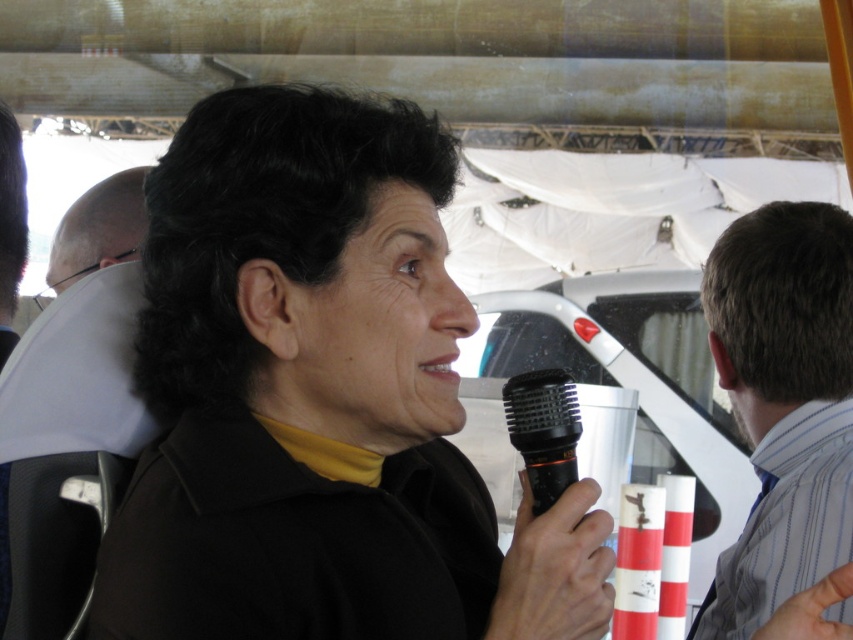
You are standing at the point with coordinates point (10,212) and want to walk towards the woman holding the microphone. Will you pass by point (534,422) on your way?

Yes, because point (534,422) is in front of point (10,212), so walking towards the woman holding the microphone would require passing through that point.

You are a photographer at the scene and want to focus on the gray striped shirt at right and the matte black microphone at left. Which object should you adjust your camera to prioritize in focus if you want the one that is closer to you to be sharp?

The gray striped shirt at right is closer to the viewer than the matte black microphone at left, so you should prioritize focusing on the gray striped shirt at right to ensure it is sharp.

Based on the photo, you are a stagehand setting up for a live event. You need to place a 70 cm long microphone stand between the black matte microphone at center and the matte black microphone at left. Is there enough space between them to fit the stand?

The distance between the black matte microphone at center and the matte black microphone at left is 68.08 centimeters. Since the microphone stand is 70 cm long, there isn not enough space to fit it between them.